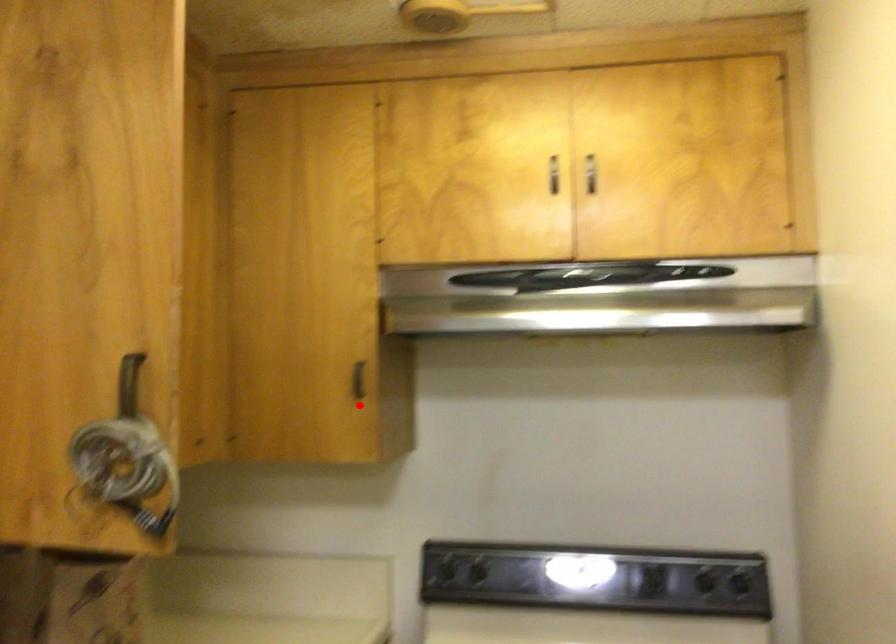
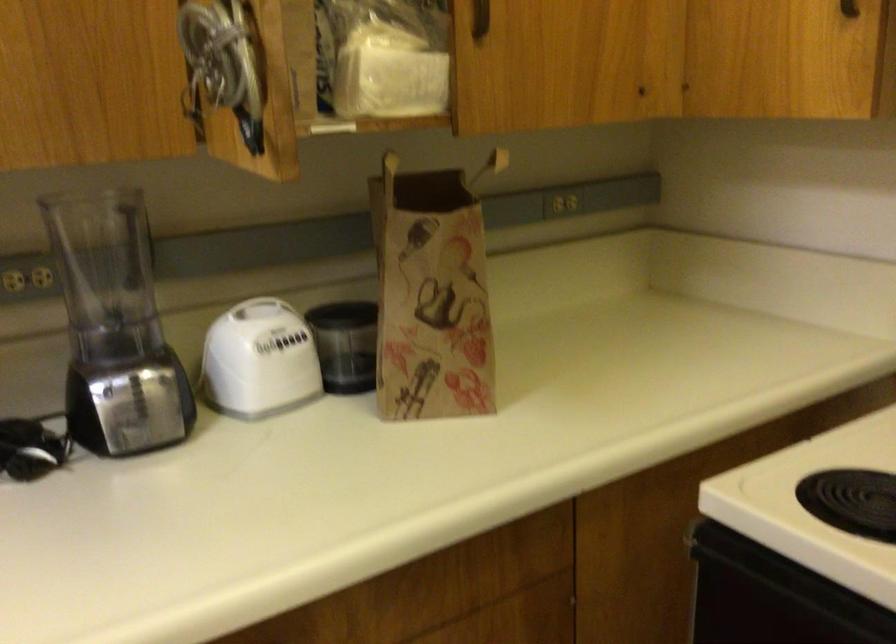
Question: I am providing you with two images of the same scene from different viewpoints. Image1 has a red point marked. In image2, the corresponding 3D location appears at what relative position? Reply with the corresponding letter.

Choices:
 (A) Closer
 (B) Farther

Answer: (A)